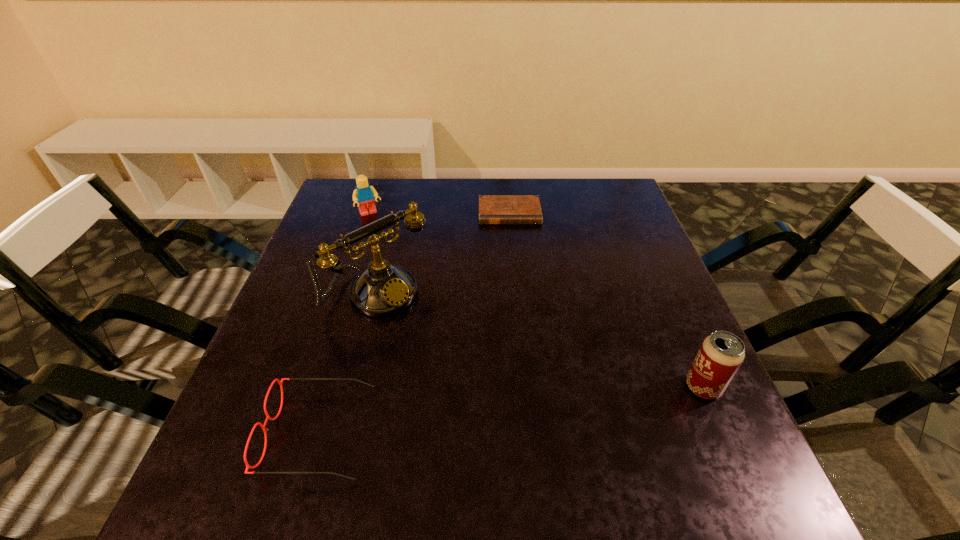
I want to click on unoccupied area between the diary and the Lego, so click(x=440, y=213).

Locate which object is the closest to the shortest object. Please provide its 2D coordinates. Your answer should be formatted as a tuple, i.e. [(x, y)], where the tuple contains the x and y coordinates of a point satisfying the conditions above.

[(383, 289)]

Choose which object is the second nearest neighbor to the Lego. Please provide its 2D coordinates. Your answer should be formatted as a tuple, i.e. [(x, y)], where the tuple contains the x and y coordinates of a point satisfying the conditions above.

[(493, 209)]

The image size is (960, 540). What are the coordinates of `vacant space that satisfies the following two spatial constraints: 1. on the front side of the Lego; 2. on the front-facing side of the spectacles` in the screenshot? It's located at (299, 433).

The image size is (960, 540). What are the coordinates of `vacant space that satisfies the following two spatial constraints: 1. on the front side of the beer can; 2. on the left side of the third nearest object` in the screenshot? It's located at (355, 387).

Identify the location of vacant region that satisfies the following two spatial constraints: 1. on the front side of the Lego; 2. on the front-facing side of the spectacles. [299, 433].

This screenshot has width=960, height=540. I want to click on vacant area that satisfies the following two spatial constraints: 1. on the back side of the fourth object from left to right; 2. on the left side of the Lego, so click(371, 213).